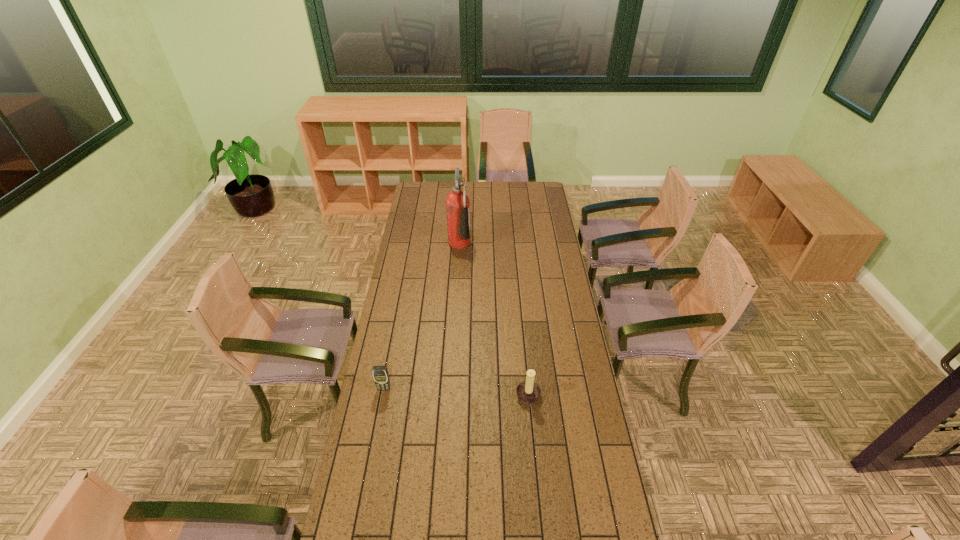
Locate an element on the screen. This screenshot has width=960, height=540. the second object from right to left is located at coordinates (457, 202).

The image size is (960, 540). Find the location of `the farthest object`. the farthest object is located at coordinates (457, 202).

This screenshot has width=960, height=540. Find the location of `the rightmost object`. the rightmost object is located at coordinates (529, 392).

Where is `cellular telephone`? The height and width of the screenshot is (540, 960). cellular telephone is located at coordinates (380, 373).

Find the location of a particular element. The width and height of the screenshot is (960, 540). the shortest object is located at coordinates pos(380,373).

At what (x,y) coordinates should I click in order to perform the action: click on free space located on the front of the second object from left to right near the operation label. Please return your answer as a coordinate pair (x, y). This screenshot has height=540, width=960. Looking at the image, I should click on (540, 243).

Find the location of `vacant region located on the wick of the rightmost object`. vacant region located on the wick of the rightmost object is located at coordinates (418, 399).

You are a GUI agent. You are given a task and a screenshot of the screen. Output one action in this format:
    pyautogui.click(x=<x>, y=<y>)
    Task: Click on the vacant space located 0.350m on the wick of the rightmost object
    This screenshot has width=960, height=540.
    Given the screenshot: What is the action you would take?
    pyautogui.click(x=428, y=399)

Locate an element on the screen. The height and width of the screenshot is (540, 960). free space located 0.130m on the wick of the rightmost object is located at coordinates (484, 399).

Locate an element on the screen. vacant region located 0.400m on the front face of the cellular telephone is located at coordinates (364, 494).